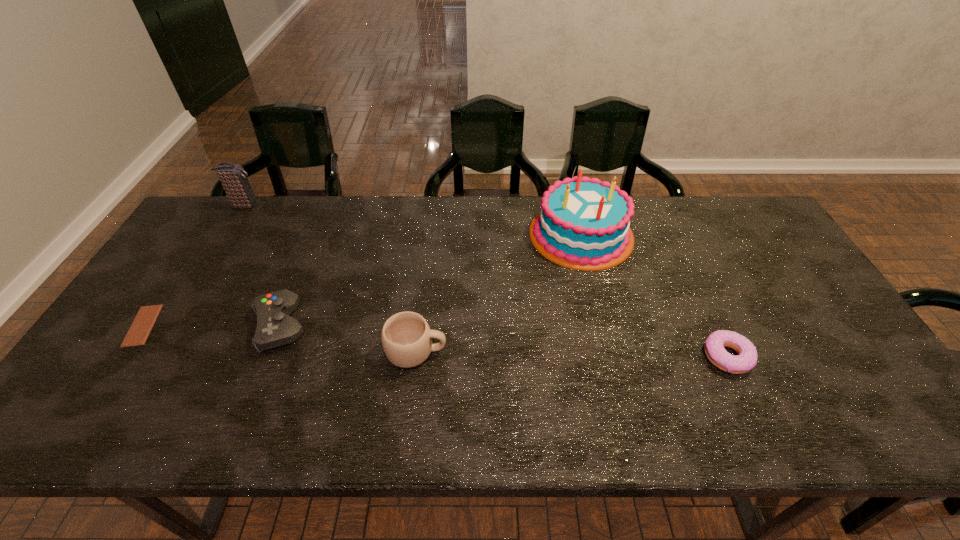
What are the coordinates of `vacant region located 0.330m on the front of the fifth object from left to right` in the screenshot? It's located at (614, 369).

The height and width of the screenshot is (540, 960). In order to click on vacant space located with the zip open on the fifth shortest object in this screenshot , I will do point(294,205).

At what (x,y) coordinates should I click in order to perform the action: click on vacant space situated on the side of the fourth shortest object with the handle. Please return your answer as a coordinate pair (x, y). Looking at the image, I should click on (499, 351).

Locate an element on the screen. free space located on the left of the control is located at coordinates (171, 326).

Image resolution: width=960 pixels, height=540 pixels. What are the coordinates of `blank space located 0.160m on the back of the doughnut` in the screenshot? It's located at (697, 291).

At what (x,y) coordinates should I click in order to perform the action: click on free point located 0.160m on the back of the shortest object. Please return your answer as a coordinate pair (x, y). The height and width of the screenshot is (540, 960). Looking at the image, I should click on (183, 264).

You are a GUI agent. You are given a task and a screenshot of the screen. Output one action in this format:
    pyautogui.click(x=<x>, y=<y>)
    Task: Click on the birthday cake at the far edge
    The image size is (960, 540).
    Given the screenshot: What is the action you would take?
    pyautogui.click(x=583, y=224)

Locate an element on the screen. clutch bag at the far edge is located at coordinates (233, 177).

I want to click on clutch bag that is positioned at the left edge, so click(233, 177).

Locate an element on the screen. The height and width of the screenshot is (540, 960). chocolate bar that is at the left edge is located at coordinates (144, 321).